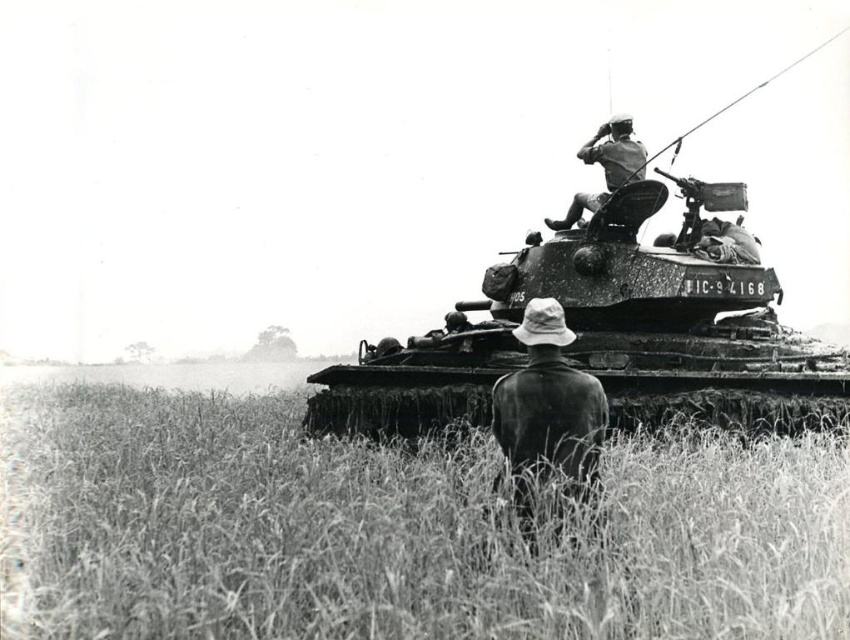
Between camouflage fabric helmet at upper center and camouflage fabric soldier at center, which one has more height?

camouflage fabric helmet at upper center

Is point (590, 163) positioned after point (714, 221)?

Yes, point (590, 163) is behind point (714, 221).

Image resolution: width=850 pixels, height=640 pixels. Find the location of `camouflage fabric helmet at upper center`. camouflage fabric helmet at upper center is located at coordinates (605, 166).

Is point (581, 376) closer to viewer compared to point (595, 193)?

Yes, point (581, 376) is in front of point (595, 193).

Is dark brown leather hat at center below camouflage fabric helmet at upper center?

Yes.

In order to click on dark brown leather hat at center in this screenshot , I will do `click(548, 410)`.

This screenshot has width=850, height=640. I want to click on dark brown leather hat at center, so click(548, 410).

Which is below, rusty metal tank at center or camouflage fabric soldier at center?

rusty metal tank at center

Is rusty metal tank at center shorter than camouflage fabric soldier at center?

No, rusty metal tank at center is not shorter than camouflage fabric soldier at center.

Which is in front, point (775, 388) or point (741, 228)?

Point (775, 388)

Locate an element on the screen. rusty metal tank at center is located at coordinates (605, 333).